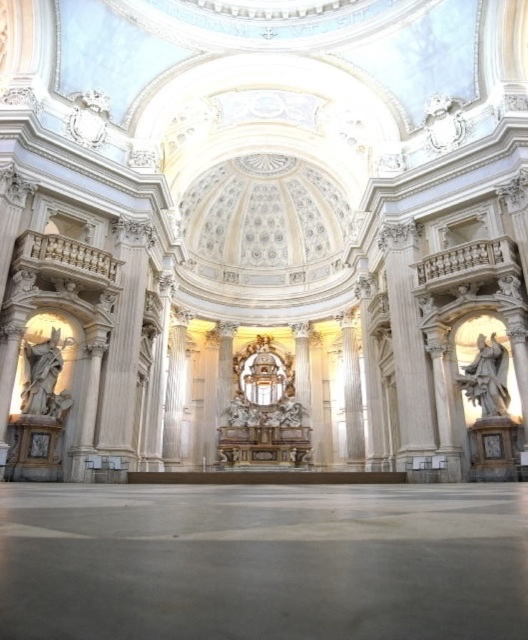
Question: Can you confirm if white marble statue at left is thinner than white marble statue at right?

Choices:
 (A) no
 (B) yes

Answer: (A)

Question: Is white marble statue at left wider than white marble statue at right?

Choices:
 (A) yes
 (B) no

Answer: (A)

Question: Which object appears closest to the camera in this image?

Choices:
 (A) white marble statue at right
 (B) white marble statue at left

Answer: (B)

Question: Does white marble statue at left appear on the right side of white marble statue at right?

Choices:
 (A) no
 (B) yes

Answer: (A)